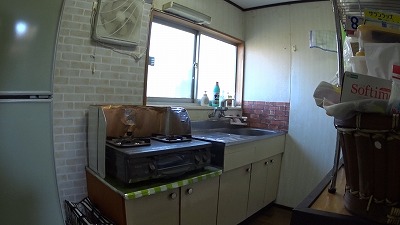
At what (x,y) coordinates should I click in order to perform the action: click on light fixture. Please return your answer as a coordinate pair (x, y). This screenshot has height=225, width=400. Looking at the image, I should click on (195, 17).